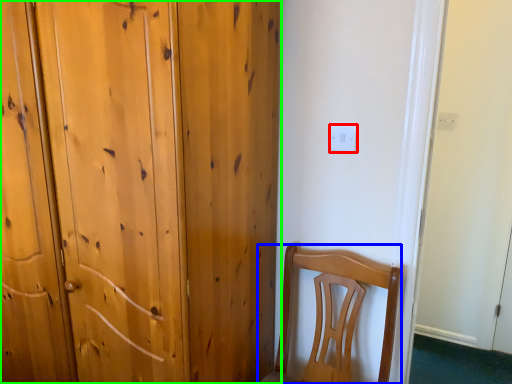
Question: Estimate the real-world distances between objects in this image. Which object is closer to electric outlet (highlighted by a red box), chair (highlighted by a blue box) or door (highlighted by a green box)?

Choices:
 (A) chair
 (B) door

Answer: (A)